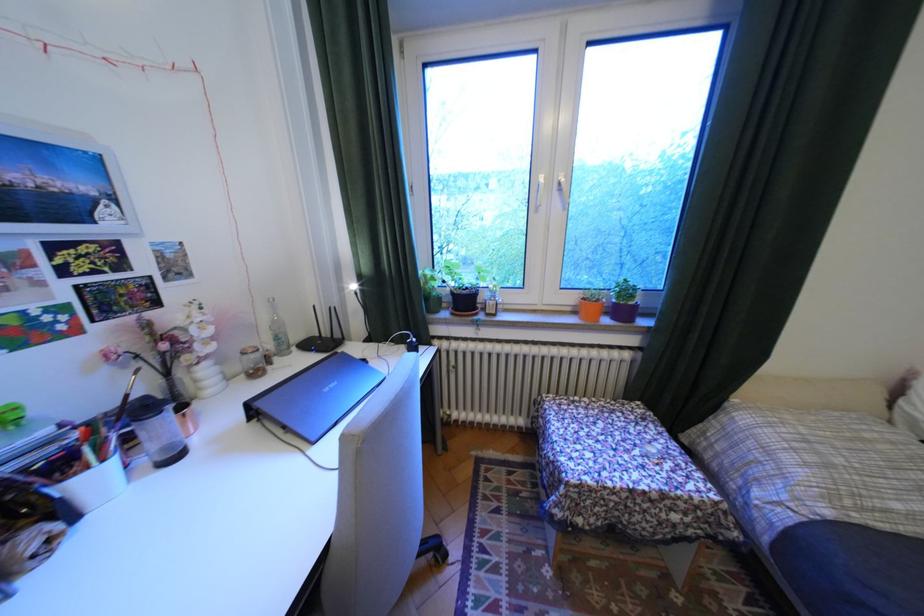
This screenshot has height=616, width=924. I want to click on small glass jar, so click(x=252, y=362).